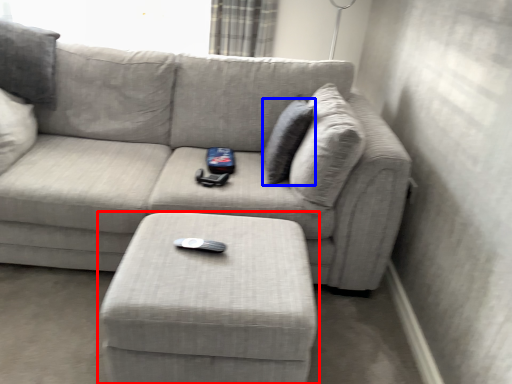
Question: Which point is closer to the camera, table (highlighted by a red box) or pillow (highlighted by a blue box)?

Choices:
 (A) table
 (B) pillow

Answer: (A)